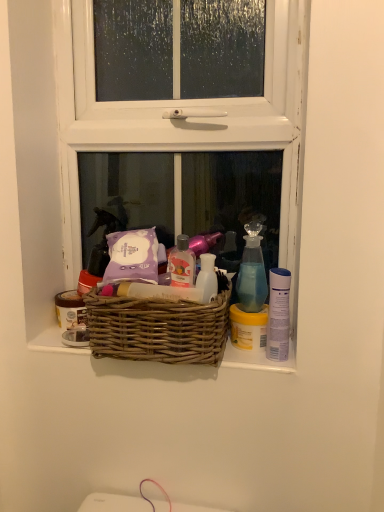
Question: Is woven brown basket at center shorter than blue glass spray bottle at upper right?

Choices:
 (A) no
 (B) yes

Answer: (B)

Question: Considering the relative sizes of woven brown basket at center and blue glass spray bottle at upper right in the image provided, is woven brown basket at center taller than blue glass spray bottle at upper right?

Choices:
 (A) no
 (B) yes

Answer: (A)

Question: Is woven brown basket at center positioned beyond the bounds of blue glass spray bottle at upper right?

Choices:
 (A) yes
 (B) no

Answer: (A)

Question: Is woven brown basket at center oriented away from blue glass spray bottle at upper right?

Choices:
 (A) yes
 (B) no

Answer: (B)

Question: Considering the relative positions of woven brown basket at center and blue glass spray bottle at upper right in the image provided, is woven brown basket at center to the right of blue glass spray bottle at upper right from the viewer's perspective?

Choices:
 (A) no
 (B) yes

Answer: (A)

Question: Is woven brown basket at center in front of blue glass spray bottle at upper right?

Choices:
 (A) yes
 (B) no

Answer: (A)

Question: Is matte brown jar at left, the first toiletry when ordered from left to right, taller than blue glass spray bottle at upper right?

Choices:
 (A) yes
 (B) no

Answer: (B)

Question: Considering the relative sizes of matte brown jar at left, the second toiletry from the right, and blue glass spray bottle at upper right in the image provided, is matte brown jar at left, the second toiletry from the right, bigger than blue glass spray bottle at upper right?

Choices:
 (A) no
 (B) yes

Answer: (A)

Question: Are matte brown jar at left, acting as the 2th toiletry starting from the front, and blue glass spray bottle at upper right located far from each other?

Choices:
 (A) yes
 (B) no

Answer: (B)

Question: Is matte brown jar at left, acting as the 2th toiletry starting from the front, facing towards blue glass spray bottle at upper right?

Choices:
 (A) yes
 (B) no

Answer: (B)

Question: Can you see matte brown jar at left, the second toiletry from the right, touching blue glass spray bottle at upper right?

Choices:
 (A) no
 (B) yes

Answer: (A)

Question: From a real-world perspective, is matte brown jar at left, the second toiletry from the right, physically below blue glass spray bottle at upper right?

Choices:
 (A) no
 (B) yes

Answer: (B)

Question: From the image's perspective, is white wooden window at center under matte brown jar at left, the first toiletry when ordered from left to right?

Choices:
 (A) no
 (B) yes

Answer: (A)